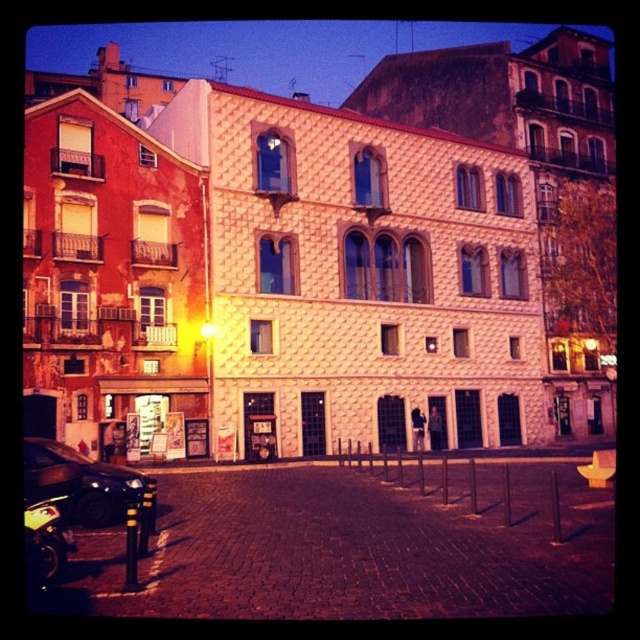
Can you confirm if shiny black car at lower left is positioned to the right of shiny black motorcycle at lower left?

No, shiny black car at lower left is not to the right of shiny black motorcycle at lower left.

Is point (106, 476) closer to viewer compared to point (68, 547)?

No, (106, 476) is further to viewer.

Find the location of a particular element. The height and width of the screenshot is (640, 640). shiny black car at lower left is located at coordinates (80, 483).